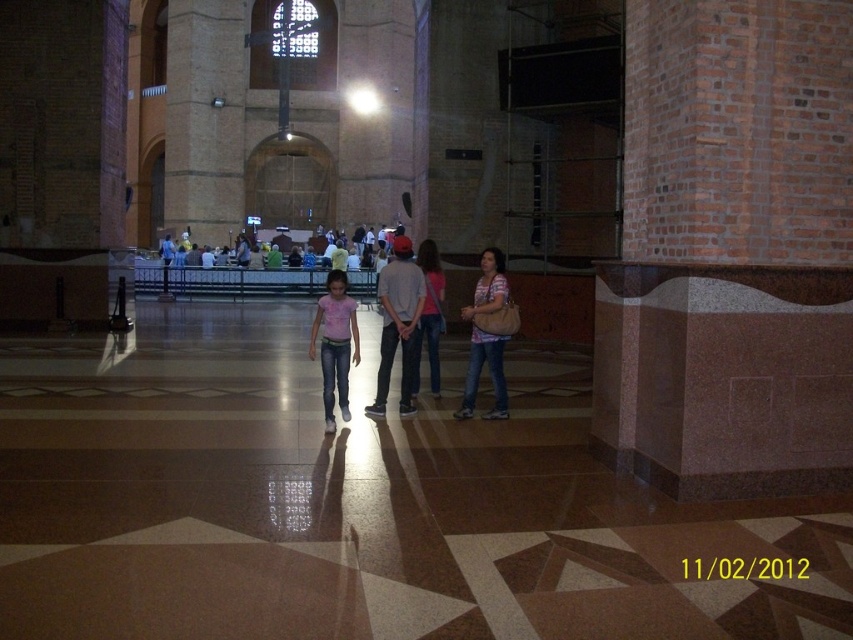
Question: Does gray cotton shirt at center have a lesser width compared to matte brown purse at center?

Choices:
 (A) no
 (B) yes

Answer: (A)

Question: Which point is farther to the camera?

Choices:
 (A) matte brown purse at center
 (B) pink denim jeans at center

Answer: (A)

Question: Is gray cotton shirt at center bigger than pink denim jeans at center?

Choices:
 (A) yes
 (B) no

Answer: (A)

Question: Does gray cotton shirt at center come in front of denim jeans at center?

Choices:
 (A) no
 (B) yes

Answer: (B)

Question: Which object appears farthest from the camera in this image?

Choices:
 (A) matte brown purse at center
 (B) gray cotton shirt at center

Answer: (B)

Question: Which object is the farthest from the pink denim jeans at center?

Choices:
 (A) matte brown purse at center
 (B) gray cotton shirt at center

Answer: (A)